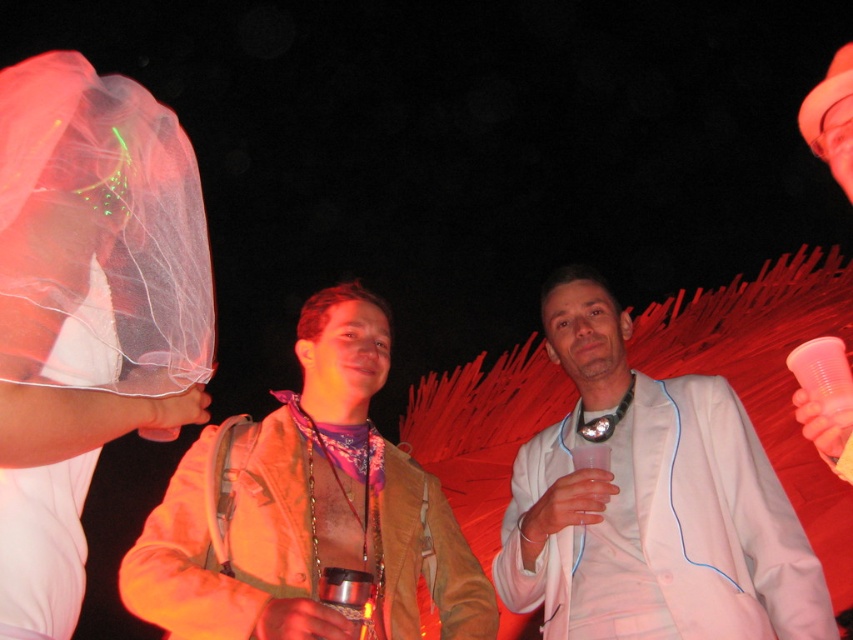
Question: Among these points, which one is farthest from the camera?

Choices:
 (A) (x=521, y=604)
 (B) (x=271, y=484)

Answer: (A)

Question: Can you confirm if white matte suit at center is smaller than brown leather jacket at center?

Choices:
 (A) yes
 (B) no

Answer: (A)

Question: Considering the relative positions of white matte suit at center and brown leather jacket at center in the image provided, where is white matte suit at center located with respect to brown leather jacket at center?

Choices:
 (A) left
 (B) right

Answer: (B)

Question: Is white matte suit at center behind brown leather jacket at center?

Choices:
 (A) yes
 (B) no

Answer: (A)